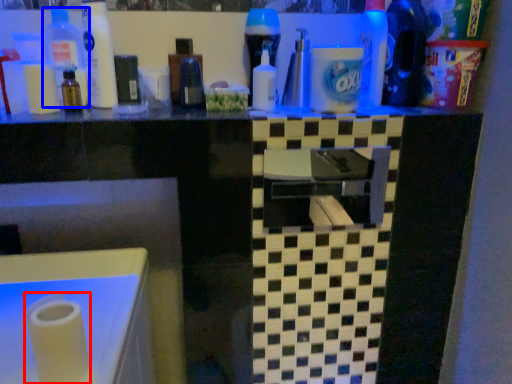
Question: Among these objects, which one is nearest to the camera, paper towel (highlighted by a red box) or bottle (highlighted by a blue box)?

Choices:
 (A) paper towel
 (B) bottle

Answer: (A)